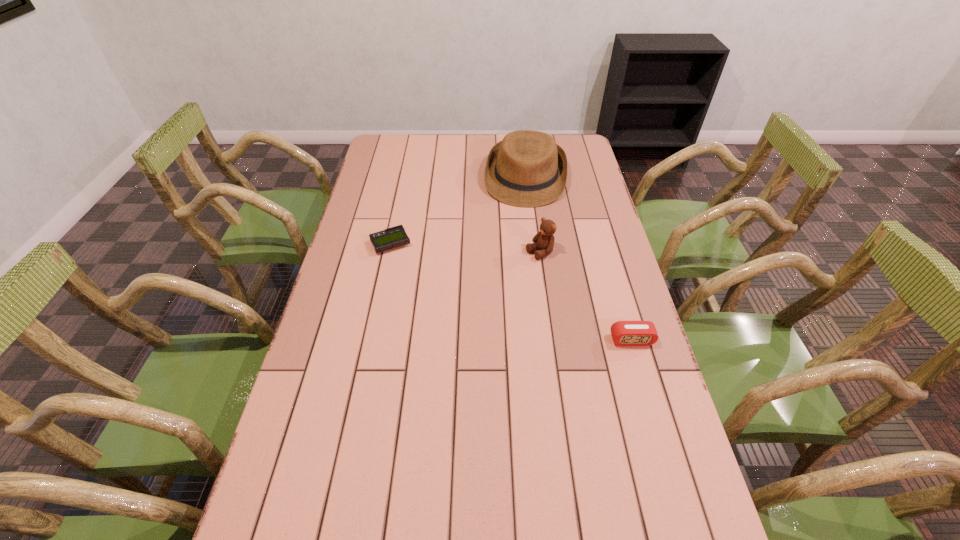
In order to click on free spot between the second tallest object and the nearest object in this screenshot , I will do `click(586, 296)`.

This screenshot has width=960, height=540. I want to click on empty location between the beeper and the fedora, so click(x=458, y=211).

Locate an element on the screen. vacant space that's between the farthest object and the shortest object is located at coordinates [458, 211].

The width and height of the screenshot is (960, 540). What are the coordinates of `the third closest object to the teddy bear` in the screenshot? It's located at (393, 237).

Where is `object identified as the second closest to the teddy bear`? This screenshot has height=540, width=960. object identified as the second closest to the teddy bear is located at coordinates (624, 333).

The width and height of the screenshot is (960, 540). Identify the location of vacant area in the image that satisfies the following two spatial constraints: 1. on the front side of the teddy bear; 2. on the right side of the fedora. (535, 253).